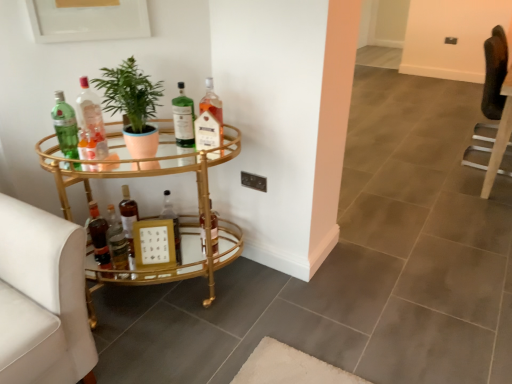
Measure the distance between point [58,326] and camera.

The distance of point [58,326] from camera is 4.33 feet.

The image size is (512, 384). Identify the location of translucent glass bottle at center, the 2th bottle when ordered from right to left. (214, 231).

In order to click on green glass bottle at center, the 3th bottle in the right-to-left sequence in this screenshot , I will do `click(183, 119)`.

This screenshot has width=512, height=384. Describe the element at coordinates (183, 119) in the screenshot. I see `green glass bottle at center, arranged as the eighth bottle when viewed from the left` at that location.

This screenshot has height=384, width=512. Identify the location of gold metallic swivel chair at left, the 1th swivel chair viewed from the left. (42, 297).

Is matte brown bottle at lower left, the 5th bottle when ordered from right to left, not within shiny brown bottle at lower left, the second bottle when ordered from left to right?

Yes, matte brown bottle at lower left, the 5th bottle when ordered from right to left, is not within shiny brown bottle at lower left, the second bottle when ordered from left to right.

Consider the image. Between matte brown bottle at lower left, the 5th bottle when ordered from right to left, and shiny brown bottle at lower left, positioned as the ninth bottle in right-to-left order, which one is positioned behind?

matte brown bottle at lower left, the 5th bottle when ordered from right to left, is more distant.

Which object is positioned more to the right, matte brown bottle at lower left, the 6th bottle viewed from the left, or shiny brown bottle at lower left, the second bottle when ordered from left to right?

Positioned to the right is matte brown bottle at lower left, the 6th bottle viewed from the left.

How much distance is there between matte brown bottle at lower left, the 6th bottle viewed from the left, and shiny brown bottle at lower left, the second bottle when ordered from left to right?

matte brown bottle at lower left, the 6th bottle viewed from the left, and shiny brown bottle at lower left, the second bottle when ordered from left to right, are 8.08 inches apart from each other.

Which of these two, matte brown bottle at lower left, the 5th bottle when ordered from right to left, or green glass bottle at center, the 3th bottle in the right-to-left sequence, stands taller?

matte brown bottle at lower left, the 5th bottle when ordered from right to left, is taller.

Based on the photo, could you tell me if matte brown bottle at lower left, the 5th bottle when ordered from right to left, is turned towards green glass bottle at center, arranged as the eighth bottle when viewed from the left?

No, matte brown bottle at lower left, the 5th bottle when ordered from right to left, is not oriented towards green glass bottle at center, arranged as the eighth bottle when viewed from the left.

Does matte brown bottle at lower left, the 6th bottle viewed from the left, appear on the left side of green glass bottle at center, the 3th bottle in the right-to-left sequence?

Yes.

Is matte brown bottle at lower left, the 5th bottle when ordered from right to left, not near translucent glass bottle at center, the 1th bottle viewed from the right?

matte brown bottle at lower left, the 5th bottle when ordered from right to left, is actually quite close to translucent glass bottle at center, the 1th bottle viewed from the right.

Considering the sizes of objects matte brown bottle at lower left, the 5th bottle when ordered from right to left, and translucent glass bottle at center, the 1th bottle viewed from the right, in the image provided, who is wider, matte brown bottle at lower left, the 5th bottle when ordered from right to left, or translucent glass bottle at center, the 1th bottle viewed from the right,?

With larger width is matte brown bottle at lower left, the 5th bottle when ordered from right to left.

Is matte brown bottle at lower left, the 6th bottle viewed from the left, to the right of translucent glass bottle at center, the tenth bottle positioned from the left, from the viewer's perspective?

No.

Is matte brown bottle at lower left, the 6th bottle viewed from the left, inside the boundaries of translucent glass bottle at center, the 1th bottle viewed from the right, or outside?

matte brown bottle at lower left, the 6th bottle viewed from the left, lies outside translucent glass bottle at center, the 1th bottle viewed from the right.

Based on their sizes in the image, would you say translucent glass bottle at center, the 2th bottle when ordered from right to left, is bigger or smaller than translucent glass bottle at center, which ranks as the 4th bottle in left-to-right order?

Clearly, translucent glass bottle at center, the 2th bottle when ordered from right to left, is larger in size than translucent glass bottle at center, which ranks as the 4th bottle in left-to-right order.

Is translucent glass bottle at center, the 2th bottle when ordered from right to left, to the left or to the right of translucent glass bottle at center, which ranks as the 4th bottle in left-to-right order, in the image?

translucent glass bottle at center, the 2th bottle when ordered from right to left, is positioned on translucent glass bottle at center, which ranks as the 4th bottle in left-to-right order,'s right side.

Is translucent glass bottle at center, the 2th bottle when ordered from right to left, wider than translucent glass bottle at center, which ranks as the 4th bottle in left-to-right order?

Yes, translucent glass bottle at center, the 2th bottle when ordered from right to left, is wider than translucent glass bottle at center, which ranks as the 4th bottle in left-to-right order.

From the picture: Is translucent glass bottle at center, the 2th bottle when ordered from right to left, closer to the viewer compared to translucent glass bottle at center, which ranks as the 4th bottle in left-to-right order?

No, translucent glass bottle at center, the 2th bottle when ordered from right to left, is behind translucent glass bottle at center, which ranks as the 4th bottle in left-to-right order.

Is translucent glass bottle at center, the tenth bottle positioned from the left, oriented away from leather swivel chair at right, the second swivel chair ordered from the bottom?

That's not correct — translucent glass bottle at center, the tenth bottle positioned from the left, is not looking away from leather swivel chair at right, the second swivel chair ordered from the bottom.

Are translucent glass bottle at center, the 1th bottle viewed from the right, and leather swivel chair at right, the 2th swivel chair from the left, beside each other?

translucent glass bottle at center, the 1th bottle viewed from the right, and leather swivel chair at right, the 2th swivel chair from the left, are clearly separated.

Which object is positioned more to the left, translucent glass bottle at center, the tenth bottle positioned from the left, or leather swivel chair at right, which ranks as the 1th swivel chair in right-to-left order?

From the viewer's perspective, translucent glass bottle at center, the tenth bottle positioned from the left, appears more on the left side.

Can you confirm if translucent glass bottle at center, the tenth bottle positioned from the left, is wider than leather swivel chair at right, the 2th swivel chair when ordered from front to back?

No.

Identify the location of swivel chair above the green matte plant at center (from the image's perspective). (494, 109).

From the picture: Considering the positions of objects green matte plant at center and leather swivel chair at right, which ranks as the 1th swivel chair in top-to-bottom order, in the image provided, who is more to the right, green matte plant at center or leather swivel chair at right, which ranks as the 1th swivel chair in top-to-bottom order,?

From the viewer's perspective, leather swivel chair at right, which ranks as the 1th swivel chair in top-to-bottom order, appears more on the right side.

Is leather swivel chair at right, arranged as the 1th swivel chair when viewed from the back, at the back of green matte plant at center?

No, green matte plant at center is not facing the opposite direction of leather swivel chair at right, arranged as the 1th swivel chair when viewed from the back.

From a real-world perspective, which is physically below, green matte plant at center or leather swivel chair at right, which ranks as the 1th swivel chair in right-to-left order?

From a 3D spatial view, leather swivel chair at right, which ranks as the 1th swivel chair in right-to-left order, is below.

Is gold metallic swivel chair at left, placed as the 2th swivel chair when sorted from back to front, completely or partially outside of matte brown bottle at lower left, the 5th bottle when ordered from right to left?

gold metallic swivel chair at left, placed as the 2th swivel chair when sorted from back to front, is positioned outside matte brown bottle at lower left, the 5th bottle when ordered from right to left.

Is gold metallic swivel chair at left, the 1th swivel chair when ordered from bottom to top, smaller than matte brown bottle at lower left, the 6th bottle viewed from the left?

No.

There is a gold metallic swivel chair at left, the 1th swivel chair viewed from the left. What are the coordinates of `the 2nd bottle below it (from a real-world perspective)` in the screenshot? It's located at (128, 218).

From the image's perspective, which is above, gold metallic swivel chair at left, the 1th swivel chair viewed from the left, or matte brown bottle at lower left, the 6th bottle viewed from the left?

matte brown bottle at lower left, the 6th bottle viewed from the left.

From the shiny brown bottle at lower left, the second bottle when ordered from left to right, count 1st bottles backward and point to it. Please provide its 2D coordinates.

[(128, 218)]

Identify the location of bottle that is the 3rd object located in front of the matte brown bottle at lower left, the 5th bottle when ordered from right to left. (183, 119).

Considering their positions, is gold metallic swivel chair at left, the 1th swivel chair viewed from the left, positioned closer to green glass bottle at center, arranged as the eighth bottle when viewed from the left, than clear glass bottle at center, positioned as the third bottle in left-to-right order?

The object closer to green glass bottle at center, arranged as the eighth bottle when viewed from the left, is clear glass bottle at center, positioned as the third bottle in left-to-right order.

Looking at this image, considering their positions, is shiny brown bottle at lower left, the second bottle when ordered from left to right, positioned closer to translucent glass bottle at center, the tenth bottle positioned from the left, than translucent glass bottle at center, which ranks as the 4th bottle in left-to-right order?

Among the two, translucent glass bottle at center, which ranks as the 4th bottle in left-to-right order, is located nearer to translucent glass bottle at center, the tenth bottle positioned from the left.

Based on their spatial positions, is shiny brown bottle at lower left, the second bottle when ordered from left to right, or clear glass bottle at center, placed as the 8th bottle when sorted from right to left, further from leather swivel chair at right, which ranks as the 1th swivel chair in right-to-left order?

shiny brown bottle at lower left, the second bottle when ordered from left to right, is further to leather swivel chair at right, which ranks as the 1th swivel chair in right-to-left order.

From the image, which object appears to be nearer to shiny gold bottle at lower left, the sixth bottle from the right, matte brown bottle at lower left, the 5th bottle when ordered from right to left, or green matte plant at center?

matte brown bottle at lower left, the 5th bottle when ordered from right to left, is positioned closer to the anchor shiny gold bottle at lower left, the sixth bottle from the right.

Considering their positions, is green matte plant at center positioned further to translucent glass bottle at center, the 1th bottle viewed from the right, than translucent glass bottle at center, which ranks as the 4th bottle in left-to-right order?

Based on the image, translucent glass bottle at center, which ranks as the 4th bottle in left-to-right order, appears to be further to translucent glass bottle at center, the 1th bottle viewed from the right.

Estimate the real-world distances between objects in this image. Which object is further from translucent glass bottle at center, acting as the seventh bottle starting from the right, green matte plant at center or clear glass bottle at center, placed as the 8th bottle when sorted from right to left?

green matte plant at center is positioned further to the anchor translucent glass bottle at center, acting as the seventh bottle starting from the right.

Looking at the image, which one is located further to shiny brown bottle at lower left, the second bottle when ordered from left to right, gold mirrored bar cart at left or green matte plant at center?

The object further to shiny brown bottle at lower left, the second bottle when ordered from left to right, is green matte plant at center.

From the image, which object appears to be nearer to green glass bottle at upper left, which ranks as the 1th bottle in left-to-right order, leather swivel chair at right, the 2th swivel chair from the left, or translucent glass bottle at center, the 2th bottle when ordered from right to left?

Based on the image, translucent glass bottle at center, the 2th bottle when ordered from right to left, appears to be nearer to green glass bottle at upper left, which ranks as the 1th bottle in left-to-right order.

Locate an element on the screen. The height and width of the screenshot is (384, 512). table between gold metallic swivel chair at left, placed as the 2th swivel chair when sorted from back to front, and green glass bottle at center, arranged as the eighth bottle when viewed from the left, from front to back is located at coordinates (145, 172).

You are a GUI agent. You are given a task and a screenshot of the screen. Output one action in this format:
    pyautogui.click(x=<x>, y=<y>)
    Task: Click on the table between matte brown bottle at lower left, the 6th bottle viewed from the left, and leather swivel chair at right, which ranks as the 1th swivel chair in top-to-bottom order, from left to right
    
    Given the screenshot: What is the action you would take?
    pyautogui.click(x=145, y=172)

Find the location of a particular element. The width and height of the screenshot is (512, 384). houseplant located between matte brown bottle at lower left, the 6th bottle viewed from the left, and leather swivel chair at right, the 2th swivel chair when ordered from front to back, in the left-right direction is located at coordinates (132, 105).

Image resolution: width=512 pixels, height=384 pixels. In order to click on table between green glass bottle at center, the 3th bottle in the right-to-left sequence, and shiny brown bottle at lower left, the second bottle when ordered from left to right, in the vertical direction in this screenshot , I will do `click(145, 172)`.